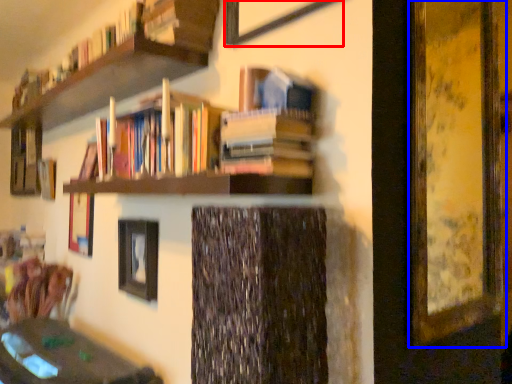
Question: Which of the following is the farthest to the observer, picture frame (highlighted by a red box) or picture frame (highlighted by a blue box)?

Choices:
 (A) picture frame
 (B) picture frame

Answer: (B)